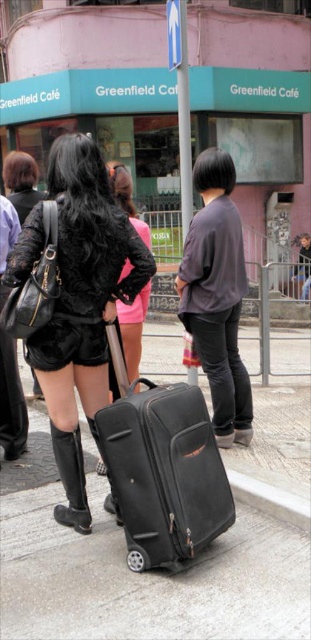
Who is more forward, (86, 376) or (194, 525)?

Positioned in front is point (194, 525).

Where is `velvet black shorts at center`? This screenshot has height=640, width=311. velvet black shorts at center is located at coordinates (74, 300).

Locate an element on the screen. The width and height of the screenshot is (311, 640). black fabric suitcase at center is located at coordinates (181, 572).

Between point (302, 435) and point (124, 321), which one is positioned in front?

Point (124, 321) is more forward.

Find the location of a particular element. The height and width of the screenshot is (640, 311). black fabric suitcase at center is located at coordinates (181, 572).

What do you see at coordinates (162, 468) in the screenshot? The image size is (311, 640). I see `black matte suitcase at center` at bounding box center [162, 468].

Is black matte suitcase at center behind matte black shorts at center?

No.

Where is `black matte suitcase at center`? black matte suitcase at center is located at coordinates click(x=162, y=468).